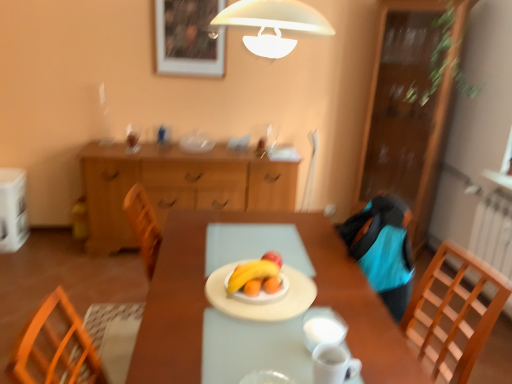
This screenshot has height=384, width=512. I want to click on free area in between shiny red apple at center and white glossy mug at center, which is counted as the second tableware, starting from the back, so click(x=296, y=300).